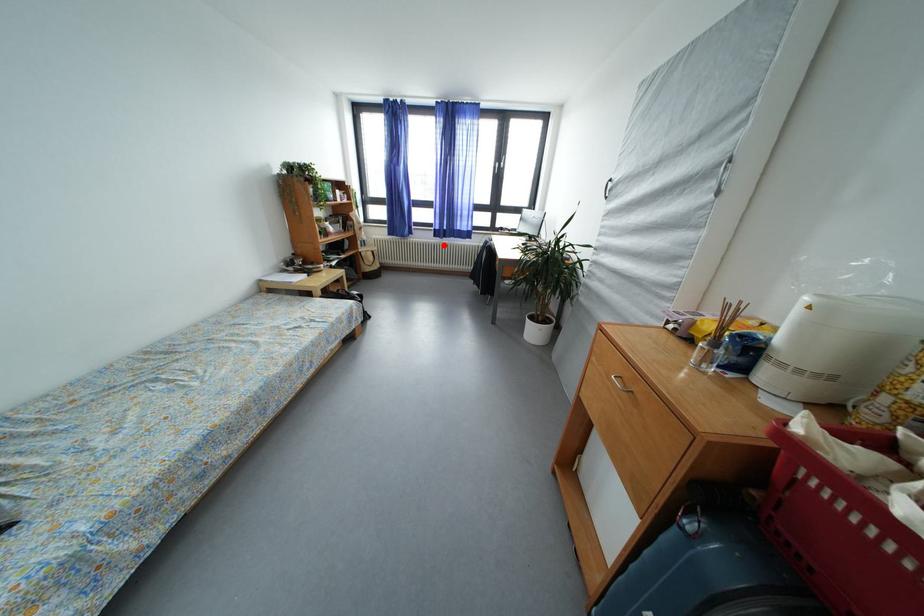
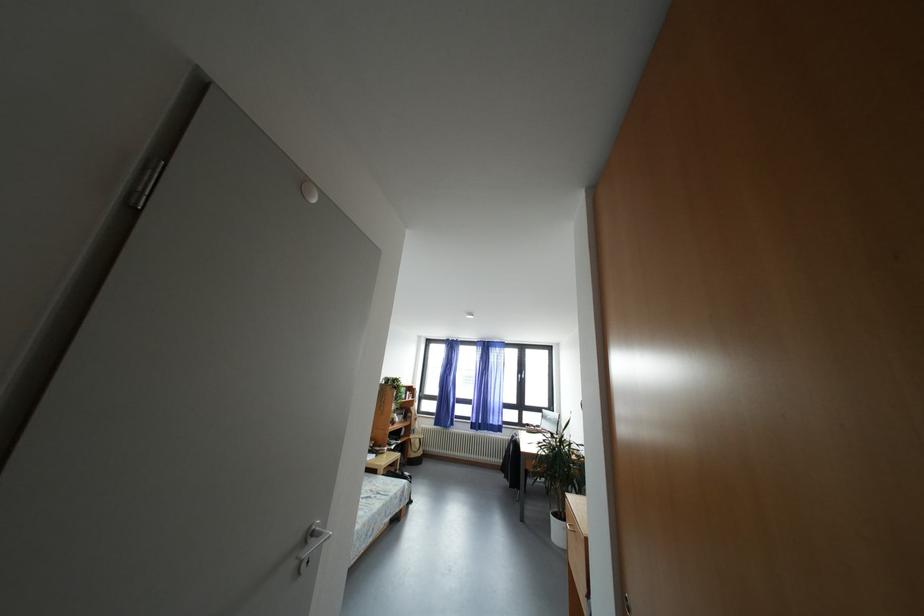
Where in the second image is the point corresponding to the highlighted location from the first image?

(480, 437)